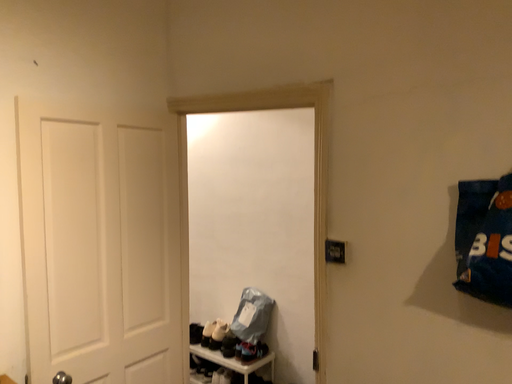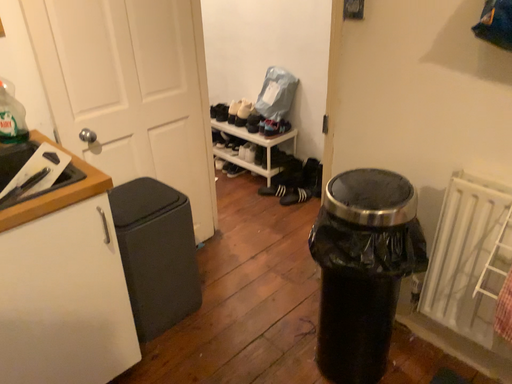
Question: How did the camera likely rotate when shooting the video?

Choices:
 (A) rotated upward
 (B) rotated downward

Answer: (B)